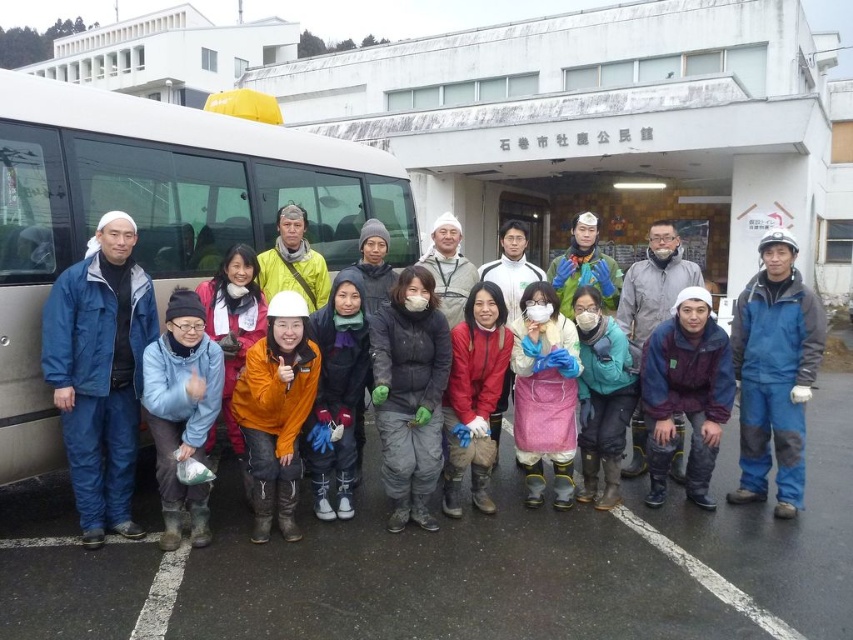
You are a photographer taking a photo of the group in front of the white building. You need to focus on the orange fleece jacket at center and the teal fabric jacket at center. Which one is positioned higher in the image?

The orange fleece jacket at center is above the teal fabric jacket at center, so it is positioned higher in the image.

You are a photographer trying to capture both the maroon fabric jacket at center and the orange softshell jacket at center in a single frame. Given their sizes, which jacket should you focus on to ensure both are visible without cropping?

The maroon fabric jacket at center is larger in size than the orange softshell jacket at center, so you should focus on the maroon fabric jacket at center to ensure both are visible without cropping.